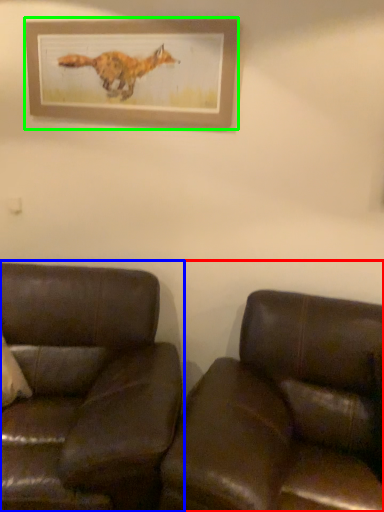
Question: Considering the real-world distances, which object is closest to studio couch (highlighted by a red box)? studio couch (highlighted by a blue box) or picture frame (highlighted by a green box).

Choices:
 (A) studio couch
 (B) picture frame

Answer: (A)